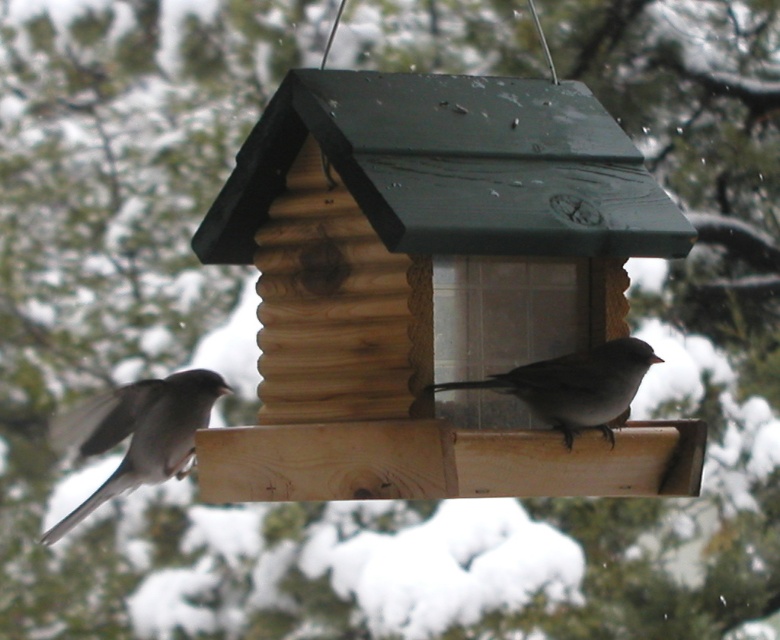
You are a birdwatcher observing the gray matte sparrow at left and the gray matte sparrow at center on the feeder. Which sparrow is positioned closer to the left side of the feeder?

The gray matte sparrow at left is positioned closer to the left side of the feeder than the gray matte sparrow at center.

You are a birdwatcher observing the two gray matte sparrows on the wooden bird feeder. Which sparrow is closer to the ground, the gray matte sparrow at left or the gray matte sparrow at center?

The gray matte sparrow at left is positioned under the gray matte sparrow at center, meaning it is closer to the ground than the gray matte sparrow at center.

You are a birdwatcher observing two gray matte sparrows on the wooden platform of the bird feeder. Which sparrow is closer to you, the gray matte sparrow at left or the gray matte sparrow at center?

The gray matte sparrow at left is closer to you because it is further to the viewer than the gray matte sparrow at center.